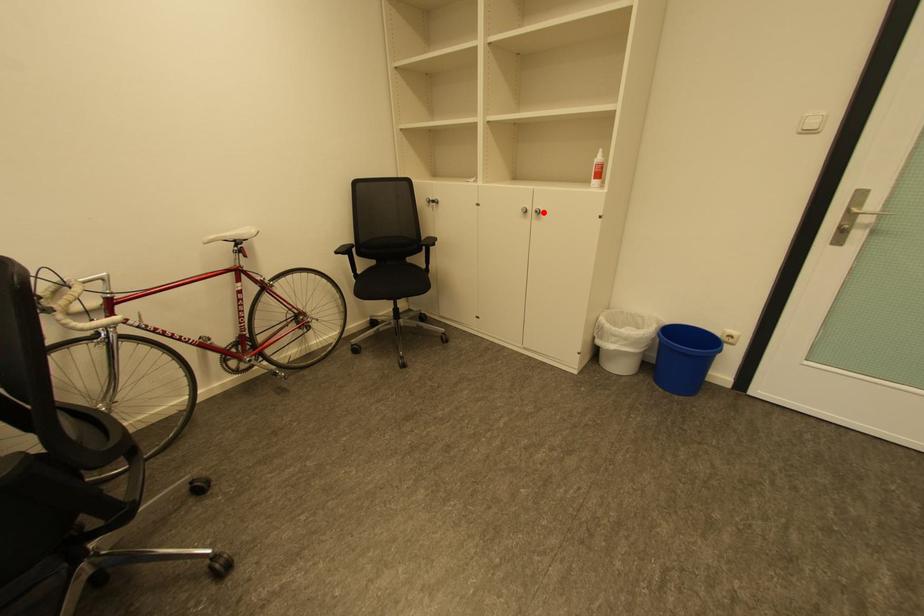
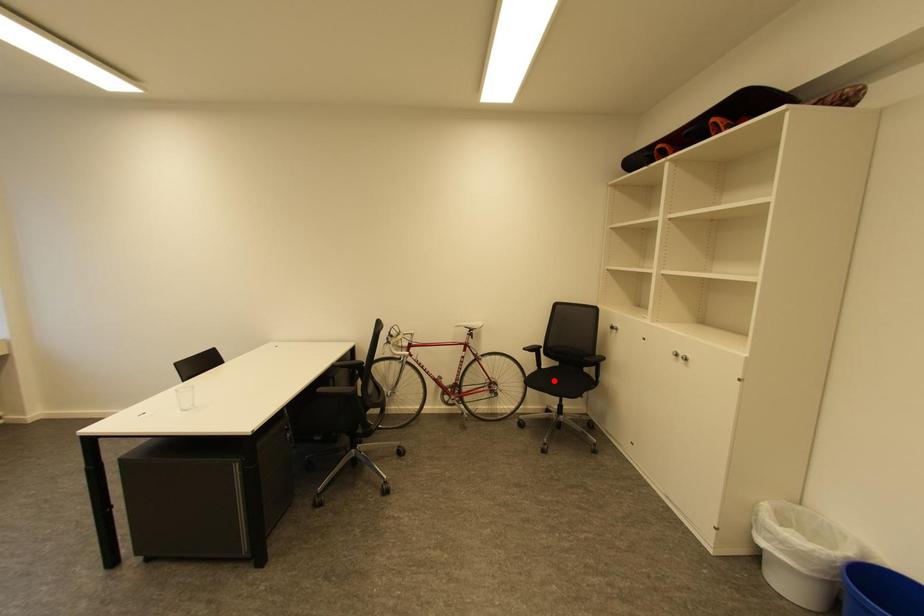
I am providing you with two images of the same scene from different viewpoints. A red point is marked on the first image and another point is marked on the second image. Are the points marked in image1 and image2 representing the same 3D position?

No